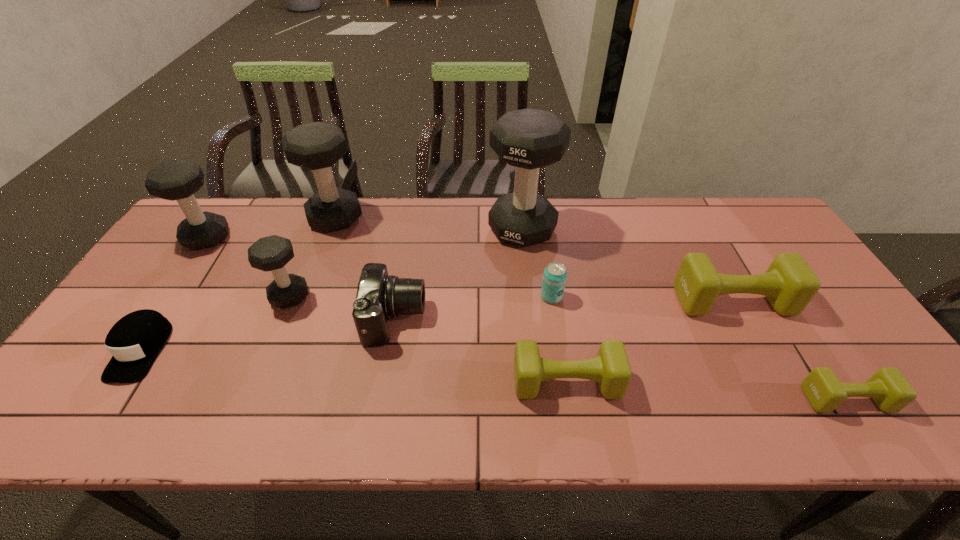
Locate which olive dumbbell is the second closest to the shortest dumbbell. Please provide its 2D coordinates. Your answer should be formatted as a tuple, i.e. [(x, y)], where the tuple contains the x and y coordinates of a point satisfying the conditions above.

[(611, 369)]

Select which olive dumbbell is the second closest to the smallest olive dumbbell. Please provide its 2D coordinates. Your answer should be formatted as a tuple, i.e. [(x, y)], where the tuple contains the x and y coordinates of a point satisfying the conditions above.

[(611, 369)]

The image size is (960, 540). I want to click on free region that satisfies the following two spatial constraints: 1. on the front side of the tallest dumbbell; 2. on the lens of the fifth object from left to right, so click(532, 319).

At what (x,y) coordinates should I click in order to perform the action: click on vacant region that satisfies the following two spatial constraints: 1. on the front side of the beer can; 2. on the left side of the third tallest dumbbell. Please return your answer as a coordinate pair (x, y). Looking at the image, I should click on (167, 296).

Locate an element on the screen. The image size is (960, 540). free spot that satisfies the following two spatial constraints: 1. on the front side of the third shortest dumbbell; 2. on the left side of the beer can is located at coordinates (552, 301).

Where is `free spot that satisfies the following two spatial constraints: 1. on the lens of the camera; 2. on the back side of the smallest olive dumbbell`? free spot that satisfies the following two spatial constraints: 1. on the lens of the camera; 2. on the back side of the smallest olive dumbbell is located at coordinates (381, 399).